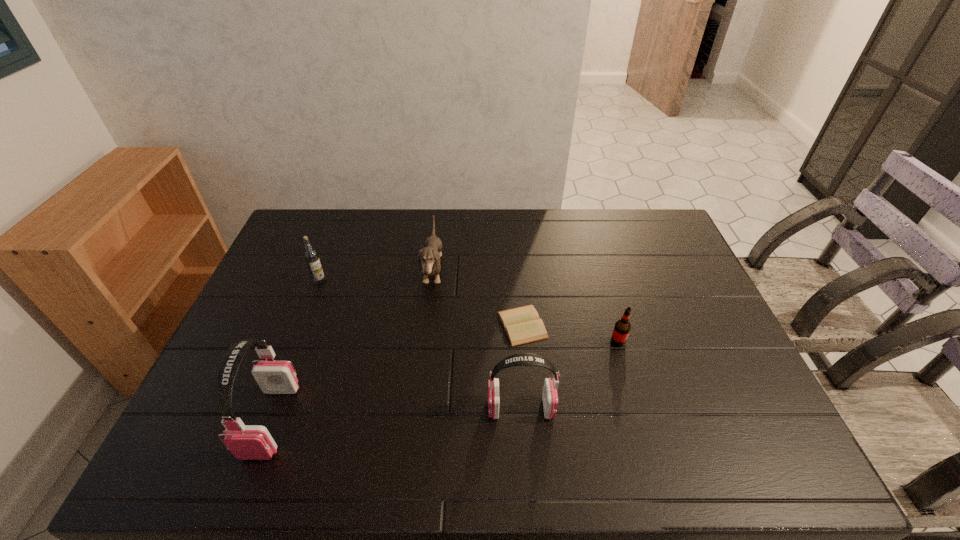
Where is `blank space that satisfies the following two spatial constraints: 1. on the label of the diary; 2. on the right side of the vodka`? This screenshot has width=960, height=540. blank space that satisfies the following two spatial constraints: 1. on the label of the diary; 2. on the right side of the vodka is located at coordinates (303, 325).

Identify the location of vacant space that satisfies the following two spatial constraints: 1. on the front side of the rightmost object; 2. on the right side of the shortest object. The width and height of the screenshot is (960, 540). (524, 342).